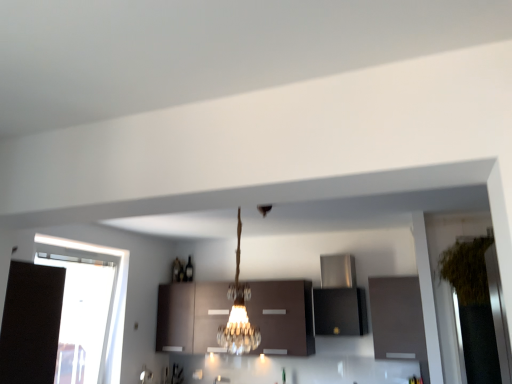
Question: Can green leafy plant at right be found inside stainless steel range hood at upper center, which is the 2th cabinetry in right-to-left order?

Choices:
 (A) no
 (B) yes

Answer: (A)

Question: Is green leafy plant at right at the back of stainless steel range hood at upper center, which is the 2th cabinetry in right-to-left order?

Choices:
 (A) no
 (B) yes

Answer: (A)

Question: Is stainless steel range hood at upper center, placed as the second cabinetry when sorted from left to right, directly adjacent to green leafy plant at right?

Choices:
 (A) yes
 (B) no

Answer: (B)

Question: Is stainless steel range hood at upper center, placed as the second cabinetry when sorted from left to right, bigger than green leafy plant at right?

Choices:
 (A) no
 (B) yes

Answer: (A)

Question: From a real-world perspective, is stainless steel range hood at upper center, placed as the second cabinetry when sorted from left to right, located higher than green leafy plant at right?

Choices:
 (A) yes
 (B) no

Answer: (B)

Question: Considering the positions of green leafy plant at right and matte brown cabinet at right, the third cabinetry when ordered from left to right, in the image, is green leafy plant at right taller or shorter than matte brown cabinet at right, the third cabinetry when ordered from left to right,?

Choices:
 (A) short
 (B) tall

Answer: (B)

Question: Is green leafy plant at right wider or thinner than matte brown cabinet at right, marked as the first cabinetry in a right-to-left arrangement?

Choices:
 (A) thin
 (B) wide

Answer: (B)

Question: Is green leafy plant at right in front of or behind matte brown cabinet at right, the third cabinetry when ordered from left to right, in the image?

Choices:
 (A) behind
 (B) front

Answer: (B)

Question: Based on their positions, is green leafy plant at right located to the left or right of matte brown cabinet at right, marked as the first cabinetry in a right-to-left arrangement?

Choices:
 (A) right
 (B) left

Answer: (A)

Question: Visually, is green leafy plant at right positioned to the left or to the right of transparent glass window at left?

Choices:
 (A) right
 (B) left

Answer: (A)

Question: Do you think green leafy plant at right is within transparent glass window at left, or outside of it?

Choices:
 (A) inside
 (B) outside

Answer: (B)

Question: Considering the positions of point (485, 236) and point (106, 367), is point (485, 236) closer or farther from the camera than point (106, 367)?

Choices:
 (A) closer
 (B) farther

Answer: (A)

Question: From their relative heights in the image, would you say green leafy plant at right is taller or shorter than transparent glass window at left?

Choices:
 (A) short
 (B) tall

Answer: (A)

Question: From a real-world perspective, is green leafy plant at right physically located above or below matte brown cabinets at center, the 1th cabinetry when ordered from left to right?

Choices:
 (A) below
 (B) above

Answer: (B)

Question: Looking at their shapes, would you say green leafy plant at right is wider or thinner than matte brown cabinets at center, the 1th cabinetry when ordered from left to right?

Choices:
 (A) thin
 (B) wide

Answer: (B)